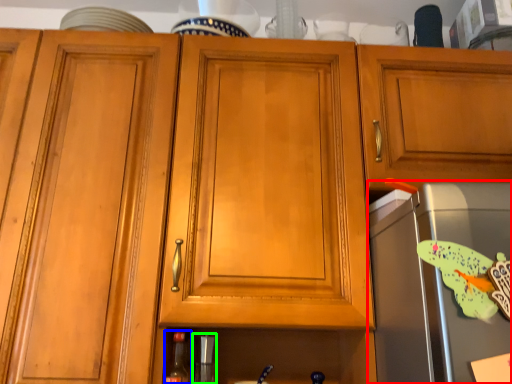
Question: Which object is positioned closest to appliance (highlighted by a red box)? Select from bottle (highlighted by a blue box) and appliance (highlighted by a green box).

Choices:
 (A) bottle
 (B) appliance

Answer: (B)